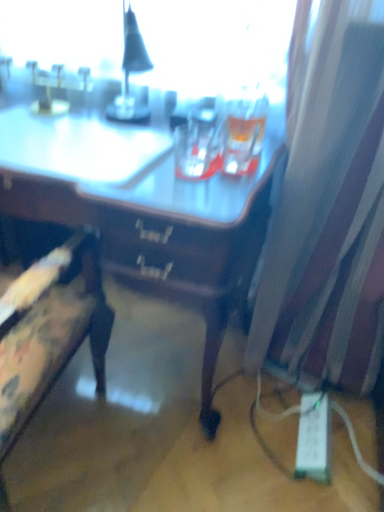
This screenshot has width=384, height=512. What do you see at coordinates (50, 329) in the screenshot?
I see `floral fabric chair at left` at bounding box center [50, 329].

What do you see at coordinates (330, 214) in the screenshot? I see `white sheer curtain at right` at bounding box center [330, 214].

This screenshot has height=512, width=384. Identify the location of floral fabric chair at left. (50, 329).

Which is behind, point (19, 346) or point (327, 453)?

Point (327, 453)

Is floral fabric chair at left looking in the opposite direction of white plastic extension cord at lower right?

No.

From the image's perspective, is floral fabric chair at left beneath white plastic extension cord at lower right?

No, from the image's perspective, floral fabric chair at left is not below white plastic extension cord at lower right.

Consider the image. Is floral fabric chair at left in front of or behind white plastic extension cord at lower right in the image?

Visually, floral fabric chair at left is located in front of white plastic extension cord at lower right.

Image resolution: width=384 pixels, height=512 pixels. I want to click on extension cord below the white sheer curtain at right (from the image's perspective), so click(314, 438).

Considering the sizes of objects white sheer curtain at right and white plastic extension cord at lower right in the image provided, who is wider, white sheer curtain at right or white plastic extension cord at lower right?

Wider between the two is white sheer curtain at right.

Does white sheer curtain at right contain white plastic extension cord at lower right?

Actually, white plastic extension cord at lower right is outside white sheer curtain at right.

Which point is more forward, (373,196) or (313,410)?

The point (373,196) is closer to the camera.

Consider the image. Who is more distant, wooden desk at center or white plastic extension cord at lower right?

white plastic extension cord at lower right is further away from the camera.

Considering the relative positions of wooden desk at center and white plastic extension cord at lower right in the image provided, is wooden desk at center to the left or to the right of white plastic extension cord at lower right?

wooden desk at center is positioned on white plastic extension cord at lower right's left side.

Can you see wooden desk at center touching white plastic extension cord at lower right?

wooden desk at center and white plastic extension cord at lower right are not in contact.

From a real-world perspective, who is located lower, wooden desk at center or white plastic extension cord at lower right?

white plastic extension cord at lower right, from a real-world perspective.

Can you confirm if white plastic extension cord at lower right is taller than floral fabric chair at left?

In fact, white plastic extension cord at lower right may be shorter than floral fabric chair at left.

Is white plastic extension cord at lower right with floral fabric chair at left?

They are not placed beside each other.

Based on their sizes in the image, would you say white plastic extension cord at lower right is bigger or smaller than floral fabric chair at left?

white plastic extension cord at lower right is smaller than floral fabric chair at left.

Is white plastic extension cord at lower right facing towards floral fabric chair at left?

No, white plastic extension cord at lower right is not facing towards floral fabric chair at left.

Would you consider white sheer curtain at right to be distant from wooden desk at center?

No, white sheer curtain at right is not far from wooden desk at center.

Between white sheer curtain at right and wooden desk at center, which one appears on the right side from the viewer's perspective?

From the viewer's perspective, white sheer curtain at right appears more on the right side.

Considering the sizes of objects white sheer curtain at right and wooden desk at center in the image provided, who is thinner, white sheer curtain at right or wooden desk at center?

white sheer curtain at right.

Is white sheer curtain at right facing towards wooden desk at center?

No, white sheer curtain at right is not turned towards wooden desk at center.

Is white sheer curtain at right surrounding floral fabric chair at left?

No, floral fabric chair at left is not surrounded by white sheer curtain at right.

Looking at the image, does white sheer curtain at right seem bigger or smaller compared to floral fabric chair at left?

white sheer curtain at right is bigger than floral fabric chair at left.

Considering the positions of point (376, 210) and point (82, 318), is point (376, 210) closer or farther from the camera than point (82, 318)?

Clearly, point (376, 210) is more distant from the camera than point (82, 318).

Which of these two, white sheer curtain at right or floral fabric chair at left, is wider?

With larger width is floral fabric chair at left.

Considering the relative positions of wooden desk at center and floral fabric chair at left in the image provided, is wooden desk at center to the right of floral fabric chair at left from the viewer's perspective?

Indeed, wooden desk at center is positioned on the right side of floral fabric chair at left.

Between wooden desk at center and floral fabric chair at left, which one has larger width?

Wider between the two is wooden desk at center.

Is wooden desk at center positioned far away from floral fabric chair at left?

No, wooden desk at center is not far from floral fabric chair at left.

Is wooden desk at center inside the boundaries of floral fabric chair at left, or outside?

wooden desk at center is outside floral fabric chair at left.

Locate an element on the screen. The width and height of the screenshot is (384, 512). chair above the white plastic extension cord at lower right (from a real-world perspective) is located at coordinates (50, 329).

Locate an element on the screen. extension cord that appears behind the white sheer curtain at right is located at coordinates (314, 438).

When comparing their distances from white plastic extension cord at lower right, does wooden desk at center or floral fabric chair at left seem closer?

Among the two, wooden desk at center is located nearer to white plastic extension cord at lower right.

Based on their spatial positions, is white plastic extension cord at lower right or wooden desk at center further from white sheer curtain at right?

white plastic extension cord at lower right is positioned further to the anchor white sheer curtain at right.

Looking at the image, which one is located further to floral fabric chair at left, white sheer curtain at right or wooden desk at center?

white sheer curtain at right.

From the image, which object appears to be nearer to wooden desk at center, white sheer curtain at right or floral fabric chair at left?

floral fabric chair at left is closer to wooden desk at center.

From the image, which object appears to be farther from white sheer curtain at right, wooden desk at center or floral fabric chair at left?

floral fabric chair at left.

Looking at the image, which one is located further to wooden desk at center, white plastic extension cord at lower right or white sheer curtain at right?

white plastic extension cord at lower right is positioned further to the anchor wooden desk at center.

Estimate the real-world distances between objects in this image. Which object is further from floral fabric chair at left, white plastic extension cord at lower right or white sheer curtain at right?

Based on the image, white plastic extension cord at lower right appears to be further to floral fabric chair at left.

From the image, which object appears to be farther from white sheer curtain at right, white plastic extension cord at lower right or floral fabric chair at left?

floral fabric chair at left lies further to white sheer curtain at right than the other object.

Find the location of `extension cord situated between wooden desk at center and white sheer curtain at right from left to right`. extension cord situated between wooden desk at center and white sheer curtain at right from left to right is located at coordinates (314, 438).

Identify the location of extension cord between floral fabric chair at left and white sheer curtain at right in the horizontal direction. (314, 438).

I want to click on desk located between floral fabric chair at left and white plastic extension cord at lower right in the left-right direction, so click(x=148, y=222).

This screenshot has height=512, width=384. In order to click on desk between floral fabric chair at left and white sheer curtain at right from left to right in this screenshot , I will do `click(148, 222)`.